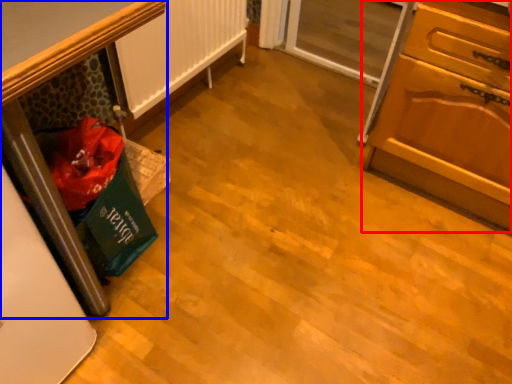
Question: Among these objects, which one is nearest to the camera, cabinetry (highlighted by a red box) or furniture (highlighted by a blue box)?

Choices:
 (A) cabinetry
 (B) furniture

Answer: (A)